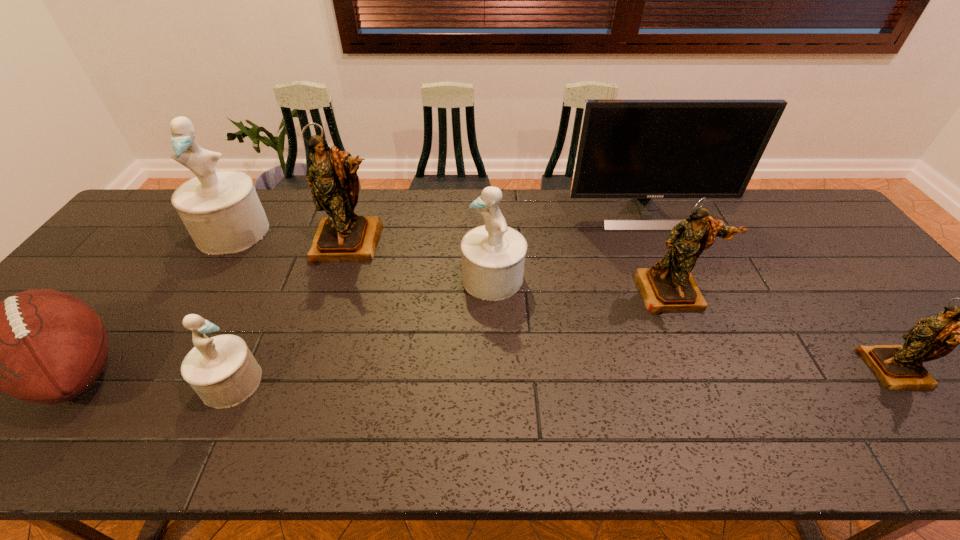
Locate an element on the screen. This screenshot has width=960, height=540. the smallest gold figurine is located at coordinates (898, 367).

This screenshot has width=960, height=540. What are the coordinates of `the nearest white figurine` in the screenshot? It's located at (223, 372).

Locate an element on the screen. This screenshot has width=960, height=540. the smallest white figurine is located at coordinates (223, 372).

Where is `vacant space situated 0.090m on the screen side of the monitor`? The image size is (960, 540). vacant space situated 0.090m on the screen side of the monitor is located at coordinates (663, 249).

At what (x,y) coordinates should I click in order to perform the action: click on vacant space located 0.130m at the beak of the farthest white figurine. Please return your answer as a coordinate pair (x, y). Image resolution: width=960 pixels, height=540 pixels. Looking at the image, I should click on (199, 287).

This screenshot has height=540, width=960. Identify the location of vacant space located on the front-facing side of the farthest gold figurine. (317, 345).

Where is `free space located at the beak of the second biggest white figurine`? The image size is (960, 540). free space located at the beak of the second biggest white figurine is located at coordinates (318, 278).

Identify the location of free space located 0.380m at the beak of the second biggest white figurine. (324, 278).

The width and height of the screenshot is (960, 540). What are the coordinates of `free space located at the beak of the second biggest white figurine` in the screenshot? It's located at (318, 278).

Image resolution: width=960 pixels, height=540 pixels. I want to click on vacant area situated on the front-facing side of the second figurine from right to left, so click(710, 384).